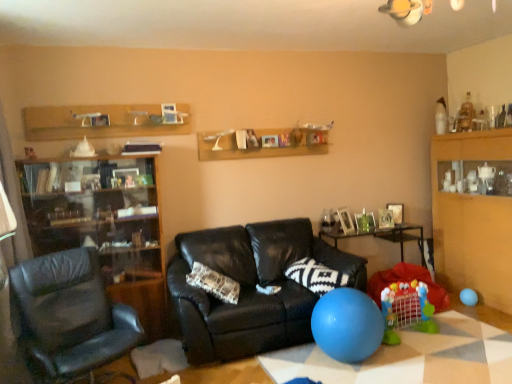
Identify the location of unoccupied region to the right of blue rubber balloon at lower center, marked as the second balloon in a back-to-front arrangement. (419, 357).